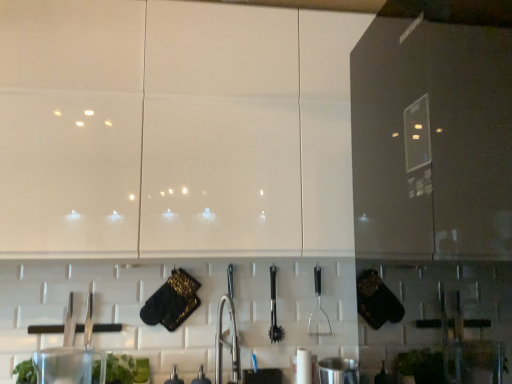
Question: Is the depth of green leafy plant at lower left less than that of metallic faucet at center, the 2th appliance when ordered from right to left?

Choices:
 (A) no
 (B) yes

Answer: (B)

Question: From a real-world perspective, is green leafy plant at lower left on top of metallic faucet at center, the third appliance from the left?

Choices:
 (A) no
 (B) yes

Answer: (B)

Question: Is green leafy plant at lower left surrounding metallic faucet at center, the 2th appliance when ordered from right to left?

Choices:
 (A) no
 (B) yes

Answer: (A)

Question: From the image's perspective, is green leafy plant at lower left over metallic faucet at center, the third appliance from the left?

Choices:
 (A) no
 (B) yes

Answer: (B)

Question: Is green leafy plant at lower left to the left of metallic faucet at center, the 2th appliance when ordered from right to left, from the viewer's perspective?

Choices:
 (A) yes
 (B) no

Answer: (A)

Question: Does green leafy plant at lower left have a lesser width compared to metallic faucet at center, the 2th appliance when ordered from right to left?

Choices:
 (A) no
 (B) yes

Answer: (A)

Question: From the image's perspective, is green leafy plant at lower left over black plastic spatula at center-right, arranged as the first silverware when viewed from the right?

Choices:
 (A) yes
 (B) no

Answer: (B)

Question: Considering the relative sizes of green leafy plant at lower left and black plastic spatula at center-right, the 2th silverware viewed from the left, in the image provided, is green leafy plant at lower left bigger than black plastic spatula at center-right, the 2th silverware viewed from the left,?

Choices:
 (A) no
 (B) yes

Answer: (B)

Question: Can you confirm if green leafy plant at lower left is taller than black plastic spatula at center-right, the 2th silverware viewed from the left?

Choices:
 (A) yes
 (B) no

Answer: (B)

Question: Is green leafy plant at lower left not close to black plastic spatula at center-right, the 2th silverware viewed from the left?

Choices:
 (A) no
 (B) yes

Answer: (A)

Question: Can you confirm if green leafy plant at lower left is positioned to the right of black plastic spatula at center-right, the 2th silverware viewed from the left?

Choices:
 (A) no
 (B) yes

Answer: (A)

Question: Is green leafy plant at lower left not within black plastic spatula at center-right, arranged as the first silverware when viewed from the right?

Choices:
 (A) no
 (B) yes

Answer: (B)

Question: Is transparent plastic container at lower left, the 4th appliance viewed from the right, positioned with its back to stainless steel pot at lower center, the 1th appliance viewed from the right?

Choices:
 (A) yes
 (B) no

Answer: (B)